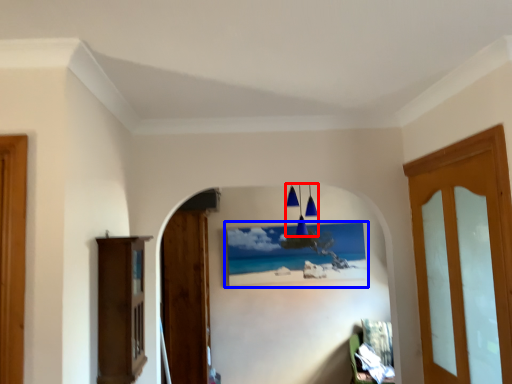
Question: Which of the following is the closest to the observer, lamp (highlighted by a red box) or picture frame (highlighted by a blue box)?

Choices:
 (A) lamp
 (B) picture frame

Answer: (A)